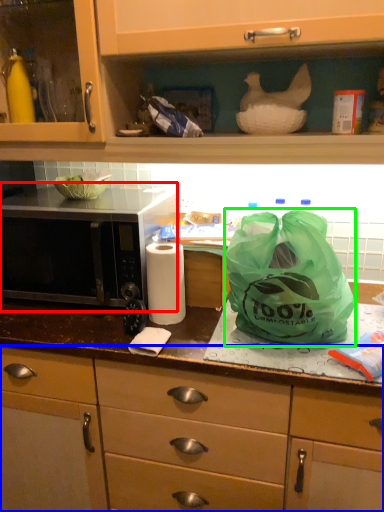
Question: Which object is the farthest from microwave (highlighted by a red box)? Choose among these: cabinetry (highlighted by a blue box) or plastic bag (highlighted by a green box).

Choices:
 (A) cabinetry
 (B) plastic bag

Answer: (B)